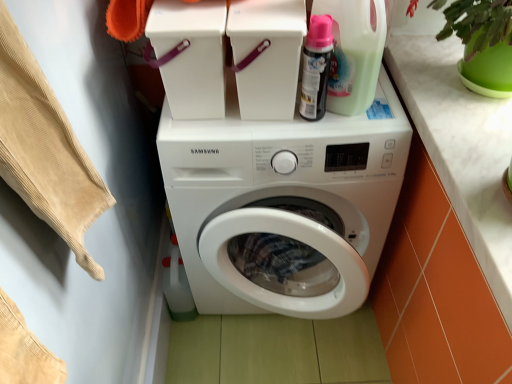
Question: From their relative heights in the image, would you say beige corduroy fabric at left is taller or shorter than matte black spray can at upper right, the first cleaning product viewed from the left?

Choices:
 (A) short
 (B) tall

Answer: (B)

Question: Relative to matte black spray can at upper right, the first cleaning product viewed from the left, is beige corduroy fabric at left in front or behind?

Choices:
 (A) front
 (B) behind

Answer: (A)

Question: Which object is the closest to the white glossy washing machine at center?

Choices:
 (A) white marble countertop at upper right
 (B) matte black spray can at upper right, which is counted as the second cleaning product, starting from the right
 (C) white plastic container at upper center
 (D) beige corduroy fabric at left
 (E) translucent plastic detergent bottle at upper right, the 1th cleaning product in the right-to-left sequence

Answer: (C)

Question: Estimate the real-world distances between objects in this image. Which object is farther from the matte black spray can at upper right, which is counted as the second cleaning product, starting from the right?

Choices:
 (A) white plastic container at upper center
 (B) white marble countertop at upper right
 (C) beige corduroy fabric at left
 (D) white glossy washing machine at center
 (E) translucent plastic detergent bottle at upper right, arranged as the 2th cleaning product when viewed from the left

Answer: (C)